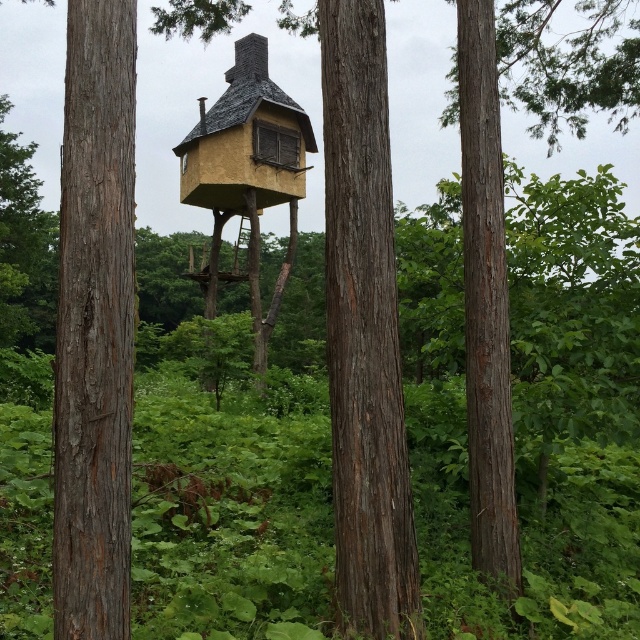
Question: Is smooth brown tree trunk at left closer to camera compared to yellow matte treehouse at center?

Choices:
 (A) no
 (B) yes

Answer: (B)

Question: Which object is closer to the camera taking this photo?

Choices:
 (A) smooth brown tree trunk at left
 (B) yellow matte treehouse at center
 (C) smooth brown tree trunk at center

Answer: (A)

Question: Which of the following is the closest to the observer?

Choices:
 (A) brown rough bark tree at center
 (B) smooth brown tree trunk at left

Answer: (B)

Question: Does smooth brown tree trunk at center appear over brown rough bark tree at center?

Choices:
 (A) no
 (B) yes

Answer: (A)

Question: Does smooth brown tree trunk at left lie behind brown rough bark tree at center?

Choices:
 (A) yes
 (B) no

Answer: (B)

Question: Based on their relative distances, which object is nearer to the yellow matte treehouse at center?

Choices:
 (A) brown rough bark tree at center
 (B) smooth brown tree trunk at center

Answer: (B)